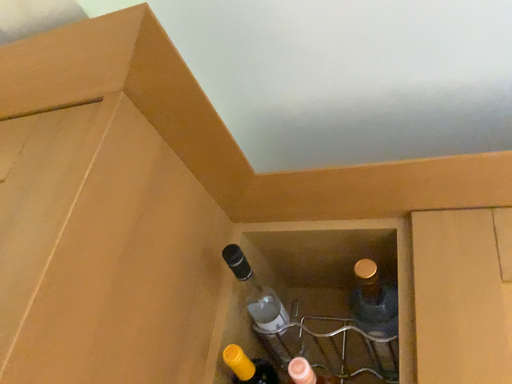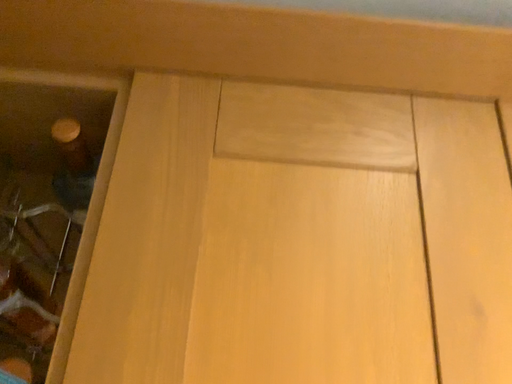
Question: How did the camera likely rotate when shooting the video?

Choices:
 (A) rotated upward
 (B) rotated downward

Answer: (B)